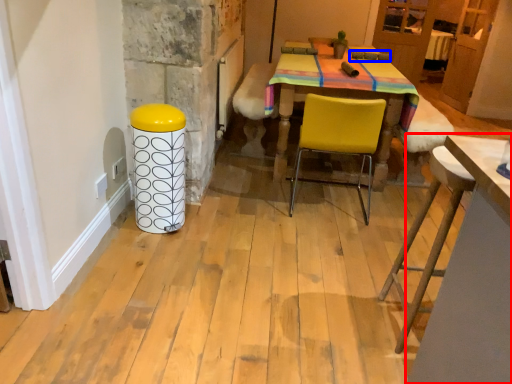
Question: Which of the following is the closest to the observer, table (highlighted by a red box) or armchair (highlighted by a blue box)?

Choices:
 (A) table
 (B) armchair

Answer: (A)